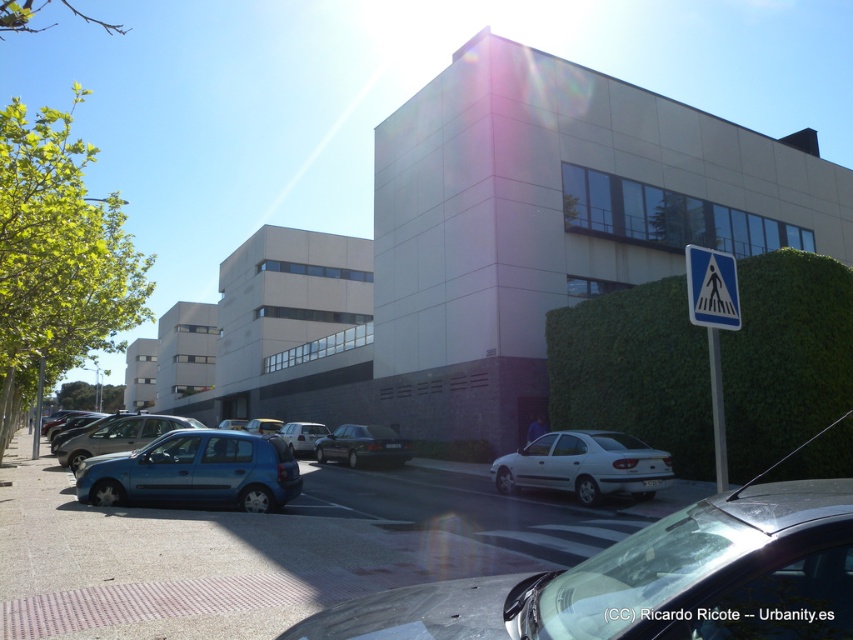
Can you confirm if blue metallic car at lower left is wider than white matte sedan at center?

Indeed, blue metallic car at lower left has a greater width compared to white matte sedan at center.

Is blue metallic car at lower left to the left of white matte sedan at center from the viewer's perspective?

Correct, you'll find blue metallic car at lower left to the left of white matte sedan at center.

Does point (247, 577) come behind point (668, 477)?

No, (247, 577) is in front of (668, 477).

Find the location of a particular element. blue metallic car at lower left is located at coordinates (271, 548).

Is white plastic pedestrian crossing sign at right further to the viewer compared to white plastic pedestrian crossing sign at lower right?

Yes, it is behind white plastic pedestrian crossing sign at lower right.

Can you confirm if white plastic pedestrian crossing sign at right is positioned above white plastic pedestrian crossing sign at lower right?

Incorrect, white plastic pedestrian crossing sign at right is not positioned above white plastic pedestrian crossing sign at lower right.

Which is in front, point (708, 259) or point (688, 278)?

Positioned in front is point (688, 278).

Image resolution: width=853 pixels, height=640 pixels. Identify the location of white plastic pedestrian crossing sign at right. (712, 326).

Can you confirm if white matte sedan at center is shorter than dark gray metallic car at center?

Indeed, white matte sedan at center has a lesser height compared to dark gray metallic car at center.

Between point (604, 477) and point (352, 422), which one is positioned in front?

Point (604, 477) is in front.

Where is `white matte sedan at center`? white matte sedan at center is located at coordinates (584, 465).